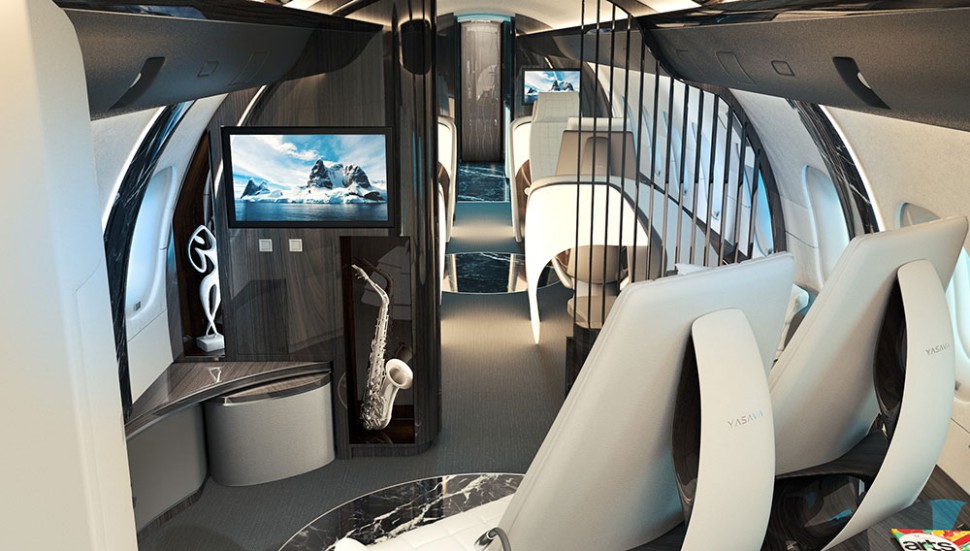
Find the location of a particular element. The width and height of the screenshot is (970, 551). black runners/storage bins is located at coordinates (243, 52), (741, 67).